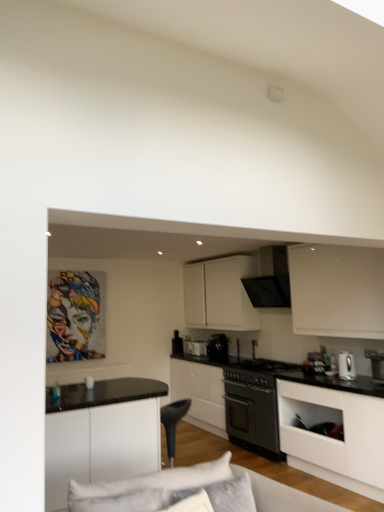
Question: Does white matte cabinet at upper center, marked as the 3th cabinetry in a front-to-back arrangement, have a greater height compared to white glossy toaster at center, the first appliance from the back?

Choices:
 (A) yes
 (B) no

Answer: (A)

Question: Does white matte cabinet at upper center, the 1th cabinetry viewed from the back, have a smaller size compared to white glossy toaster at center, acting as the first appliance starting from the left?

Choices:
 (A) no
 (B) yes

Answer: (A)

Question: Is white matte cabinet at upper center, marked as the 3th cabinetry in a front-to-back arrangement, at the right side of white glossy toaster at center, the first appliance from the back?

Choices:
 (A) yes
 (B) no

Answer: (A)

Question: Does white matte cabinet at upper center, the 1th cabinetry viewed from the back, turn towards white glossy toaster at center, which is the fifth appliance from front to back?

Choices:
 (A) no
 (B) yes

Answer: (A)

Question: Considering the relative sizes of white matte cabinet at upper center, the 1th cabinetry viewed from the back, and white glossy toaster at center, the first appliance from the back, in the image provided, is white matte cabinet at upper center, the 1th cabinetry viewed from the back, thinner than white glossy toaster at center, the first appliance from the back,?

Choices:
 (A) yes
 (B) no

Answer: (B)

Question: From their relative heights in the image, would you say white glossy kettle at right, the 1th appliance from the right, is taller or shorter than white matte cabinet at upper center, the 1th cabinetry viewed from the back?

Choices:
 (A) short
 (B) tall

Answer: (A)

Question: In terms of size, does white glossy kettle at right, positioned as the first appliance in front-to-back order, appear bigger or smaller than white matte cabinet at upper center, marked as the 3th cabinetry in a front-to-back arrangement?

Choices:
 (A) big
 (B) small

Answer: (B)

Question: Looking at their shapes, would you say white glossy kettle at right, positioned as the first appliance in front-to-back order, is wider or thinner than white matte cabinet at upper center, the 1th cabinetry viewed from the back?

Choices:
 (A) wide
 (B) thin

Answer: (B)

Question: From a real-world perspective, is white glossy kettle at right, positioned as the first appliance in front-to-back order, physically located above or below white matte cabinet at upper center, the 1th cabinetry viewed from the back?

Choices:
 (A) above
 (B) below

Answer: (B)

Question: Based on their sizes in the image, would you say white fabric couch at lower center is bigger or smaller than white matte cabinet at lower right, positioned as the 1th cabinetry in front-to-back order?

Choices:
 (A) small
 (B) big

Answer: (B)

Question: Considering the positions of white fabric couch at lower center and white matte cabinet at lower right, which appears as the 3th cabinetry when viewed from the back, in the image, is white fabric couch at lower center taller or shorter than white matte cabinet at lower right, which appears as the 3th cabinetry when viewed from the back,?

Choices:
 (A) tall
 (B) short

Answer: (B)

Question: From a real-world perspective, relative to white matte cabinet at lower right, which appears as the 3th cabinetry when viewed from the back, is white fabric couch at lower center vertically above or below?

Choices:
 (A) above
 (B) below

Answer: (A)

Question: From the image's perspective, is white fabric couch at lower center above or below white matte cabinet at lower right, positioned as the 1th cabinetry in front-to-back order?

Choices:
 (A) above
 (B) below

Answer: (A)

Question: Do you think black matte oven at center, positioned as the 4th appliance in left-to-right order, is within white matte cabinet at lower right, positioned as the 1th cabinetry in front-to-back order, or outside of it?

Choices:
 (A) outside
 (B) inside

Answer: (A)

Question: Looking at their shapes, would you say black matte oven at center, positioned as the 4th appliance in left-to-right order, is wider or thinner than white matte cabinet at lower right, positioned as the 1th cabinetry in front-to-back order?

Choices:
 (A) thin
 (B) wide

Answer: (B)